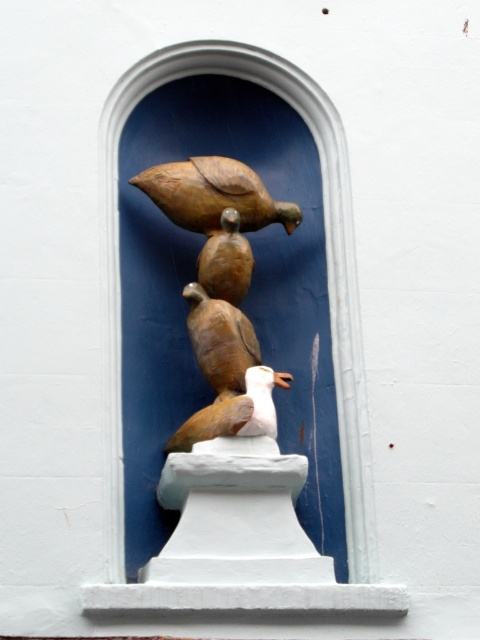
Question: Is brown matte bird at center thinner than white matte bird at center?

Choices:
 (A) yes
 (B) no

Answer: (A)

Question: Which of the following is the closest to the observer?

Choices:
 (A) brown matte bird at center
 (B) white matte bird at center

Answer: (B)

Question: Can you confirm if brown matte bird at center is positioned to the right of white matte bird at center?

Choices:
 (A) yes
 (B) no

Answer: (B)

Question: Is brown matte bird at center in front of white matte bird at center?

Choices:
 (A) no
 (B) yes

Answer: (A)